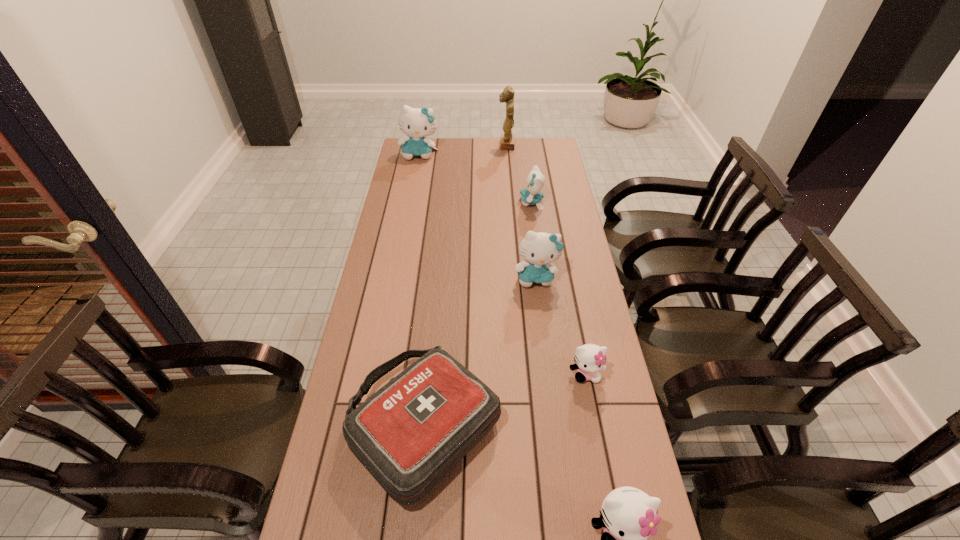
This screenshot has height=540, width=960. What are the coordinates of `figurine` in the screenshot? It's located at (507, 139).

You are a GUI agent. You are given a task and a screenshot of the screen. Output one action in this format:
    pyautogui.click(x=<x>, y=<y>)
    Task: Click on the tallest kitten
    
    Given the screenshot: What is the action you would take?
    pyautogui.click(x=417, y=123)

What are the coordinates of `the leftmost blue kitten` in the screenshot? It's located at (417, 123).

Image resolution: width=960 pixels, height=540 pixels. I want to click on the fifth shortest object, so coord(539,249).

Where is `the fourth nearest object`? the fourth nearest object is located at coordinates (539, 249).

Where is `the second farthest blue kitten`? the second farthest blue kitten is located at coordinates (531, 195).

Find the location of a particular element. the third farthest object is located at coordinates (531, 195).

Find the location of a particular element. The image size is (960, 540). red first-aid kit is located at coordinates (409, 434).

Locate an element on the screen. The image size is (960, 540). the farther white kitten is located at coordinates (590, 358).

Image resolution: width=960 pixels, height=540 pixels. In order to click on the second nearest kitten in this screenshot , I will do (x=590, y=358).